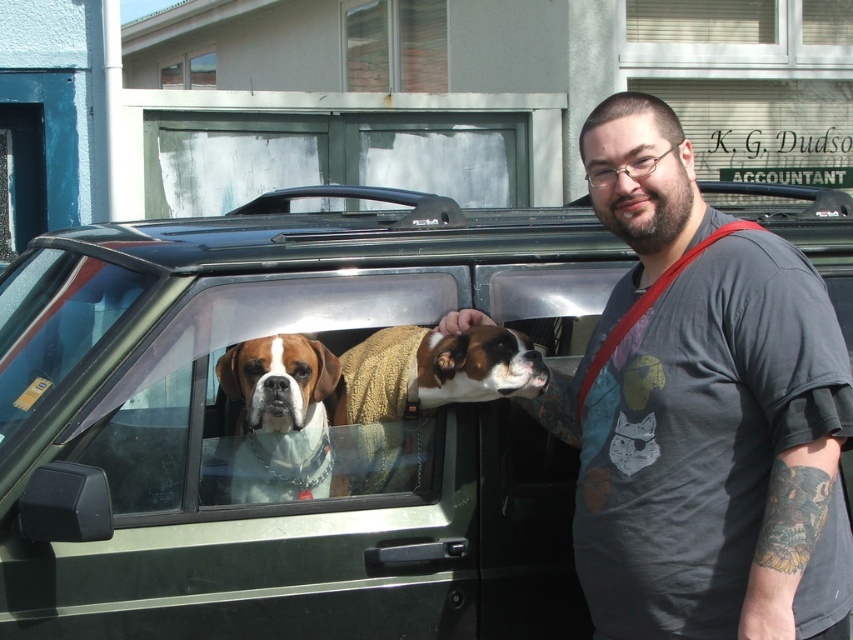
This screenshot has width=853, height=640. What do you see at coordinates (242, 401) in the screenshot? I see `clear glass window at center` at bounding box center [242, 401].

Can you confirm if clear glass window at center is positioned below brick wall at upper center?

Yes, clear glass window at center is below brick wall at upper center.

Does point (335, 288) come farther from viewer compared to point (360, 12)?

That is False.

Where is `clear glass window at center`? The image size is (853, 640). clear glass window at center is located at coordinates (242, 401).

Between dark gray t-shirt at center and brick wall at upper center, which one appears on the right side from the viewer's perspective?

Positioned to the right is dark gray t-shirt at center.

Can you confirm if dark gray t-shirt at center is bigger than brick wall at upper center?

No, dark gray t-shirt at center is not bigger than brick wall at upper center.

Between point (660, 625) and point (422, 54), which one is positioned behind?

Positioned behind is point (422, 54).

You are a GUI agent. You are given a task and a screenshot of the screen. Output one action in this format:
    pyautogui.click(x=<x>, y=<y>)
    Task: Click on the dark gray t-shirt at center
    Image resolution: width=853 pixels, height=640 pixels.
    Given the screenshot: What is the action you would take?
    pyautogui.click(x=703, y=412)

Does point (358, 486) come in front of point (254, 470)?

No, it is behind (254, 470).

This screenshot has width=853, height=640. What do you see at coordinates (416, 397) in the screenshot?
I see `brown and white fur at car window` at bounding box center [416, 397].

This screenshot has width=853, height=640. I want to click on brown and white fur at car window, so click(x=416, y=397).